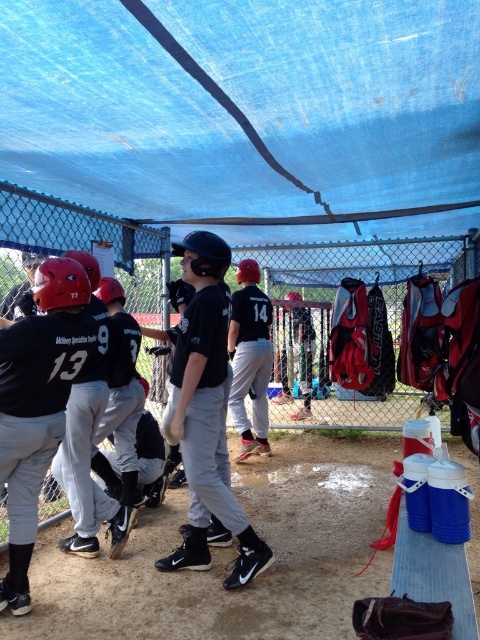
Based on the photo, can you confirm if black matte jersey at left is positioned below matte black helmet at center?

Yes, black matte jersey at left is below matte black helmet at center.

At what (x,y) coordinates should I click in order to perform the action: click on black matte jersey at left. Please return your answer as a coordinate pair (x, y). The width and height of the screenshot is (480, 640). Looking at the image, I should click on (37, 403).

What are the coordinates of `black matte jersey at left` in the screenshot? It's located at (37, 403).

At what (x,y) coordinates should I click in order to perform the action: click on black matte jersey at left. Please return your answer as a coordinate pair (x, y). Looking at the image, I should click on (37, 403).

Is point (263, 417) more distant than point (425, 618)?

Yes, it is.

Who is more forward, [264,438] or [384,628]?

Point [384,628] is more forward.

Find the location of `black matte jersey at center`. black matte jersey at center is located at coordinates 250,358.

Between black matte uniform at center and black matte jersey at center, which one appears on the left side from the viewer's perspective?

Positioned to the left is black matte uniform at center.

Is point (225, 452) less distant than point (256, 308)?

Yes, it is.

The height and width of the screenshot is (640, 480). I want to click on black matte uniform at center, so click(207, 416).